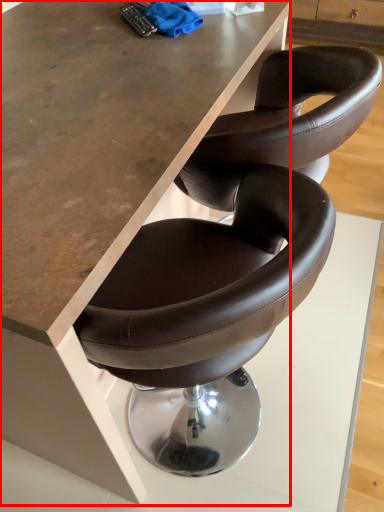
Question: From the image's perspective, considering the relative positions of table (annotated by the red box) and material in the image provided, where is table (annotated by the red box) located with respect to the staircase?

Choices:
 (A) above
 (B) below

Answer: (B)